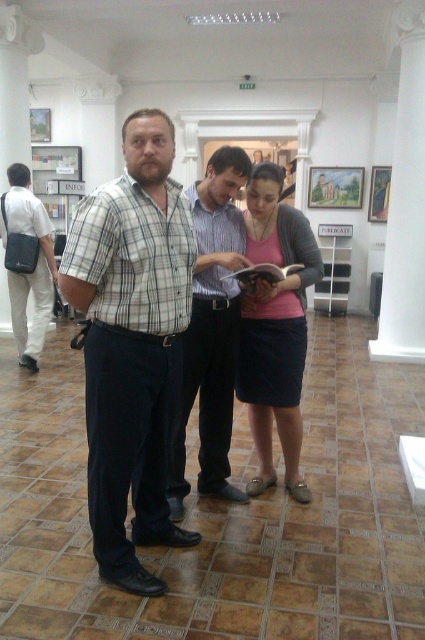
Question: Does plaid cotton shirt at center have a lesser width compared to matte black bag at left?

Choices:
 (A) no
 (B) yes

Answer: (B)

Question: Is plaid shirt at center wider than matte black bag at left?

Choices:
 (A) yes
 (B) no

Answer: (B)

Question: Among these objects, which one is nearest to the camera?

Choices:
 (A) plaid shirt at center
 (B) matte pink shirt at center
 (C) matte black bag at left

Answer: (A)

Question: Which point is farther to the camera?

Choices:
 (A) (110, 522)
 (B) (34, 320)
 (C) (295, 376)
 (D) (217, 474)

Answer: (B)

Question: Is plaid cotton shirt at center wider than plaid shirt at center?

Choices:
 (A) no
 (B) yes

Answer: (B)

Question: Which object is positioned farthest from the matte pink shirt at center?

Choices:
 (A) plaid cotton shirt at center
 (B) matte black bag at left

Answer: (B)